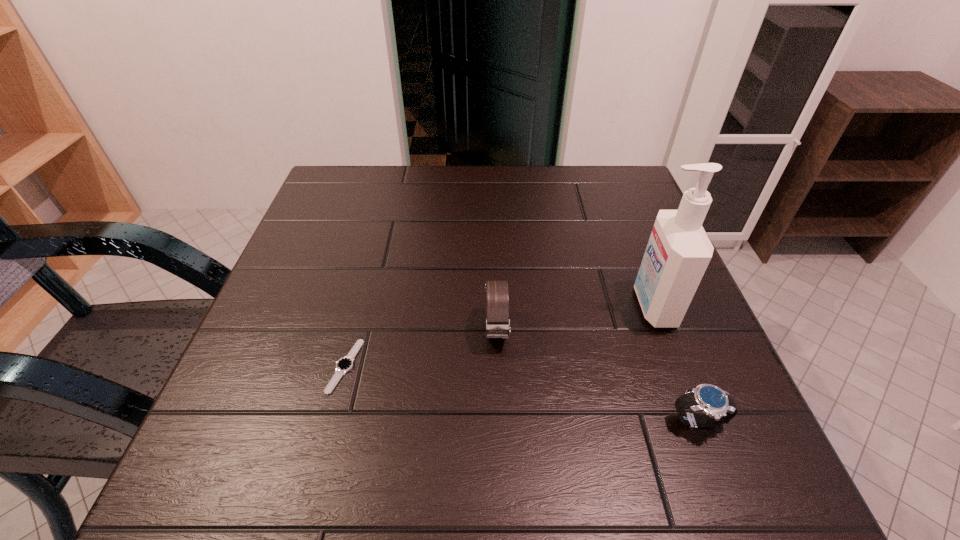
Locate which watch is the closest to the third shortest object. Please provide its 2D coordinates. Your answer should be formatted as a tuple, i.e. [(x, y)], where the tuple contains the x and y coordinates of a point satisfying the conditions above.

[(345, 364)]

This screenshot has width=960, height=540. I want to click on watch object that ranks as the second closest to the second object from left to right, so click(x=718, y=406).

The width and height of the screenshot is (960, 540). What are the coordinates of `vacant area in the image that satisfies the following two spatial constraints: 1. on the front side of the rightmost watch; 2. on the right side of the shortest watch` in the screenshot? It's located at (330, 422).

Where is `vacant region that satisfies the following two spatial constraints: 1. on the front label of the cleansing agent; 2. on the left side of the rightmost watch`? vacant region that satisfies the following two spatial constraints: 1. on the front label of the cleansing agent; 2. on the left side of the rightmost watch is located at coordinates (698, 422).

This screenshot has height=540, width=960. What are the coordinates of `vacant space that satisfies the following two spatial constraints: 1. on the face of the second tallest object; 2. on the right side of the nearest watch` in the screenshot? It's located at (500, 422).

You are a GUI agent. You are given a task and a screenshot of the screen. Output one action in this format:
    pyautogui.click(x=<x>, y=<y>)
    Task: Click on the vacant region that satisfies the following two spatial constraints: 1. on the front label of the tallest object; 2. on the right side of the rightmost watch
    The width and height of the screenshot is (960, 540).
    Given the screenshot: What is the action you would take?
    pyautogui.click(x=698, y=422)

The image size is (960, 540). What are the coordinates of `vacant point that satisfies the following two spatial constraints: 1. on the front label of the tallest object; 2. on the right side of the nearest object` in the screenshot? It's located at (698, 422).